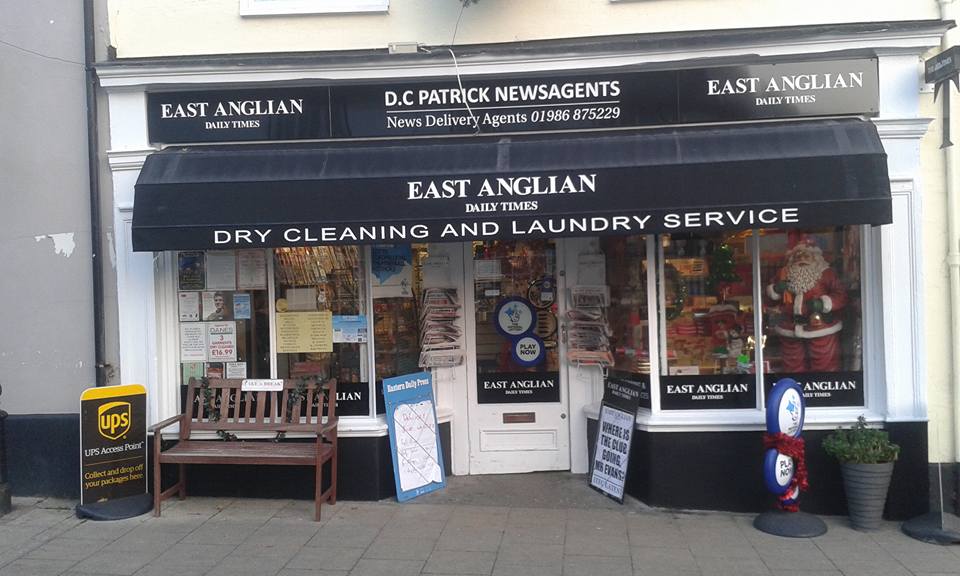
Identify the location of door handle to open door. The width and height of the screenshot is (960, 576). (562, 332).